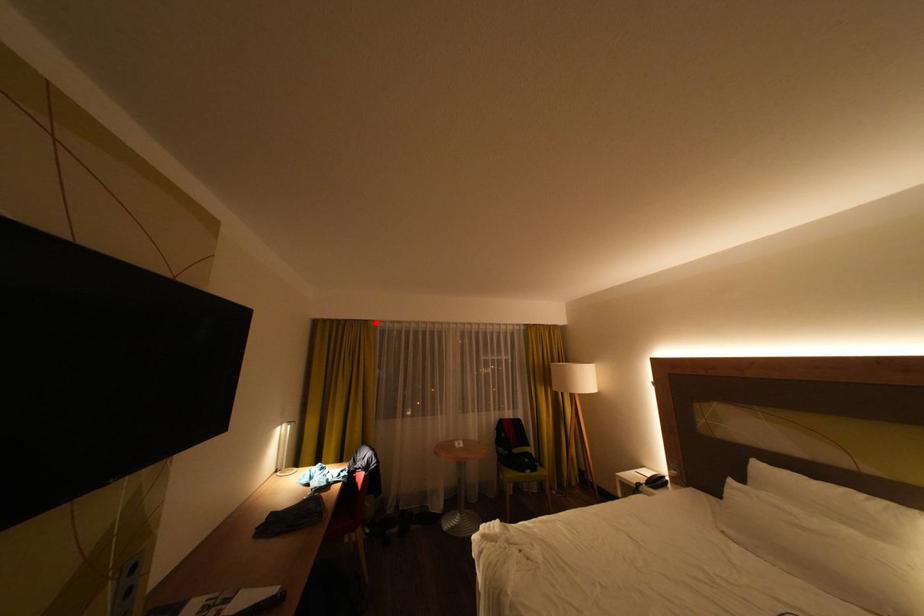
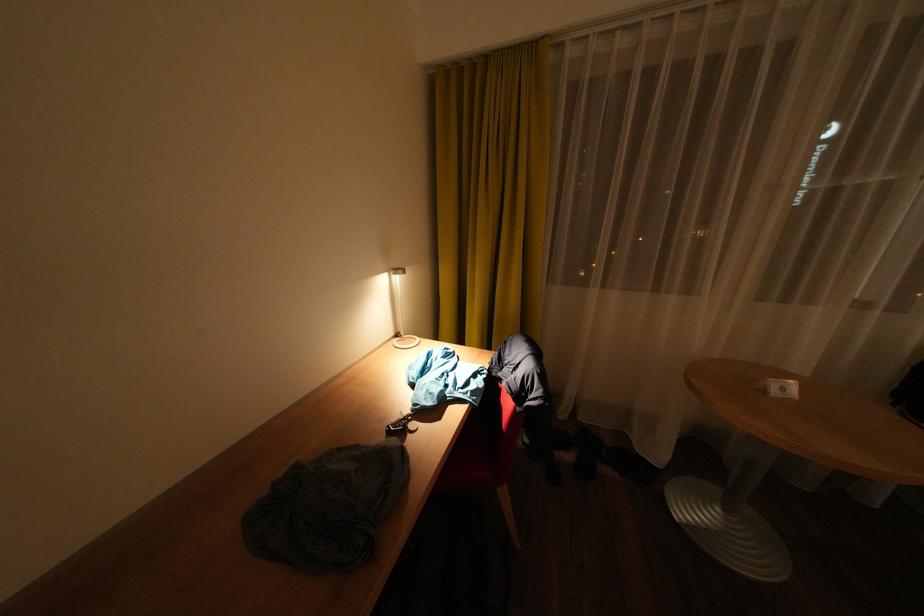
Locate, in the second image, the point that corresponds to the highlighted location in the first image.

(544, 47)